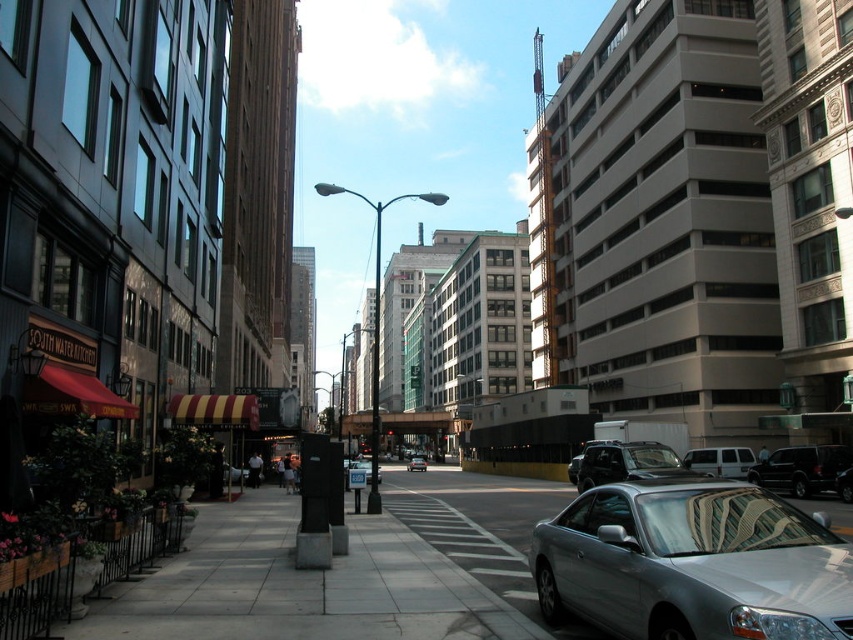
Does gray concrete sidewalk at center have a larger size compared to shiny black suv at center?

No.

Where is `gray concrete sidewalk at center`? The width and height of the screenshot is (853, 640). gray concrete sidewalk at center is located at coordinates (302, 586).

Which is below, gray concrete sidewalk at center or silver metallic sedan at center?

silver metallic sedan at center is below.

Is gray concrete sidewalk at center wider than silver metallic sedan at center?

Indeed, gray concrete sidewalk at center has a greater width compared to silver metallic sedan at center.

Between point (466, 637) and point (413, 467), which one is positioned behind?

The point (413, 467) is behind.

Find the location of a particular element. The image size is (853, 640). gray concrete sidewalk at center is located at coordinates (302, 586).

Between shiny black suv at center and white matte van at center, which one is positioned lower?

white matte van at center is lower down.

Describe the element at coordinates (625, 464) in the screenshot. This screenshot has width=853, height=640. I see `shiny black suv at center` at that location.

This screenshot has width=853, height=640. In order to click on shiny black suv at center in this screenshot , I will do [625, 464].